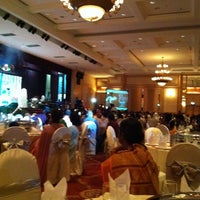
Locate an element on the screen. fancy white celing is located at coordinates (129, 52).